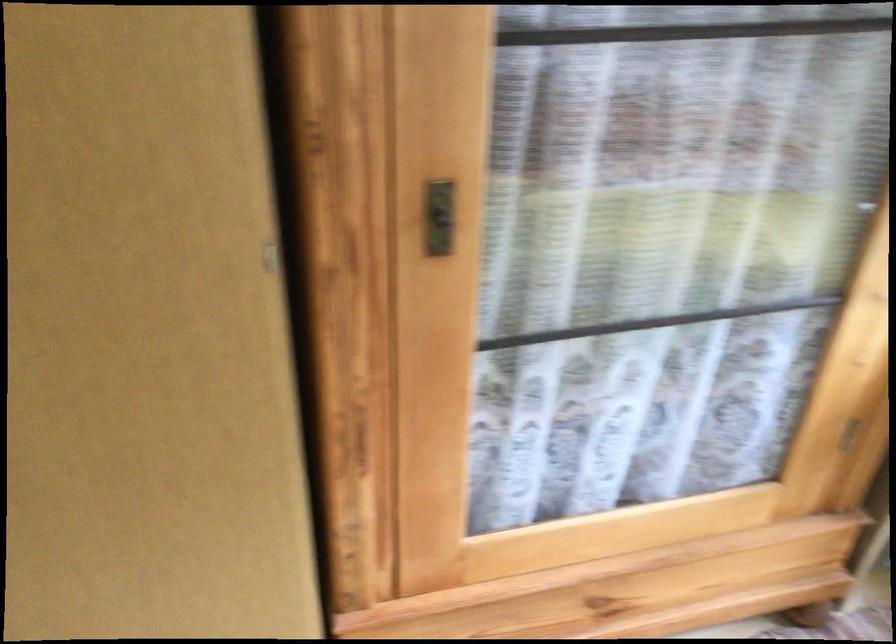
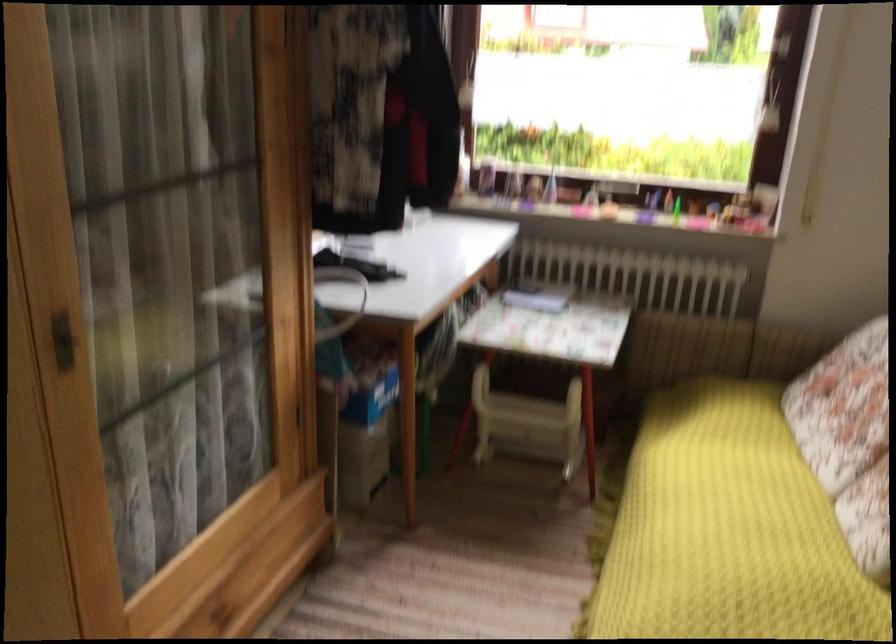
Where in the second image is the point corresponding to the point at 459,225 from the first image?

(63, 341)